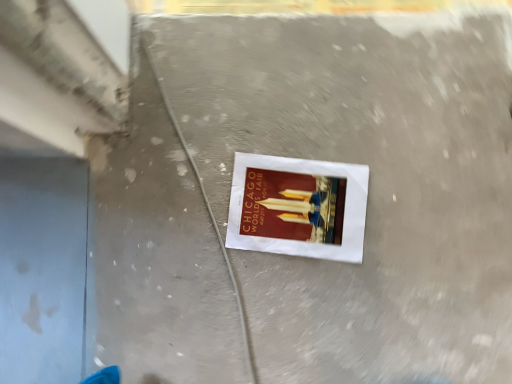
Locate an element on the screen. Image resolution: width=512 pixels, height=384 pixels. free space in front of white paper poster at center is located at coordinates (295, 307).